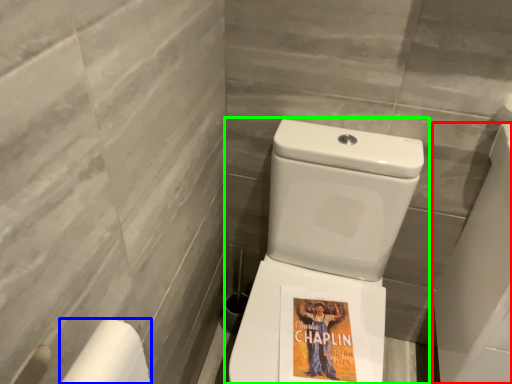
Question: Considering the real-world distances, which object is closest to porcelain (highlighted by a red box)? toilet paper (highlighted by a blue box) or toilet (highlighted by a green box).

Choices:
 (A) toilet paper
 (B) toilet

Answer: (B)